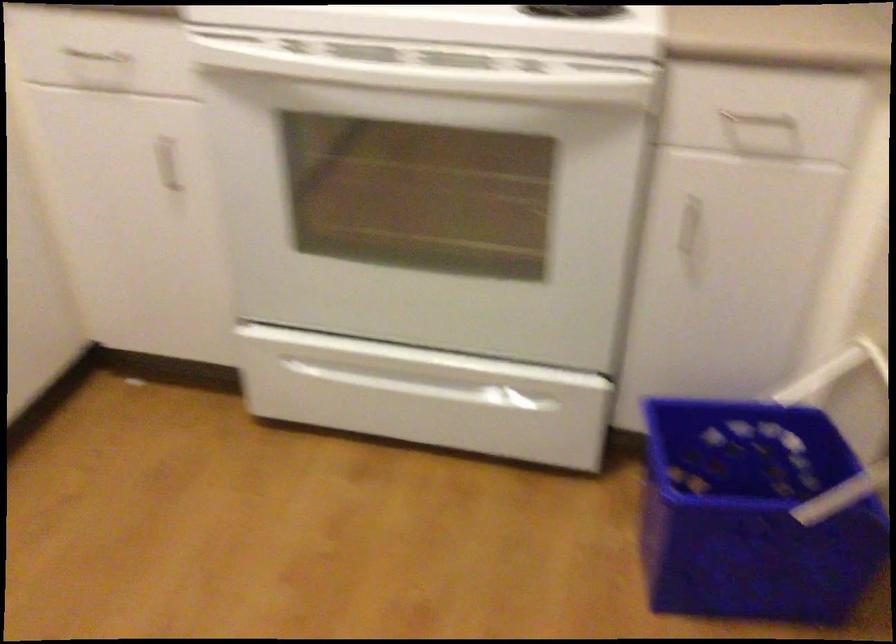
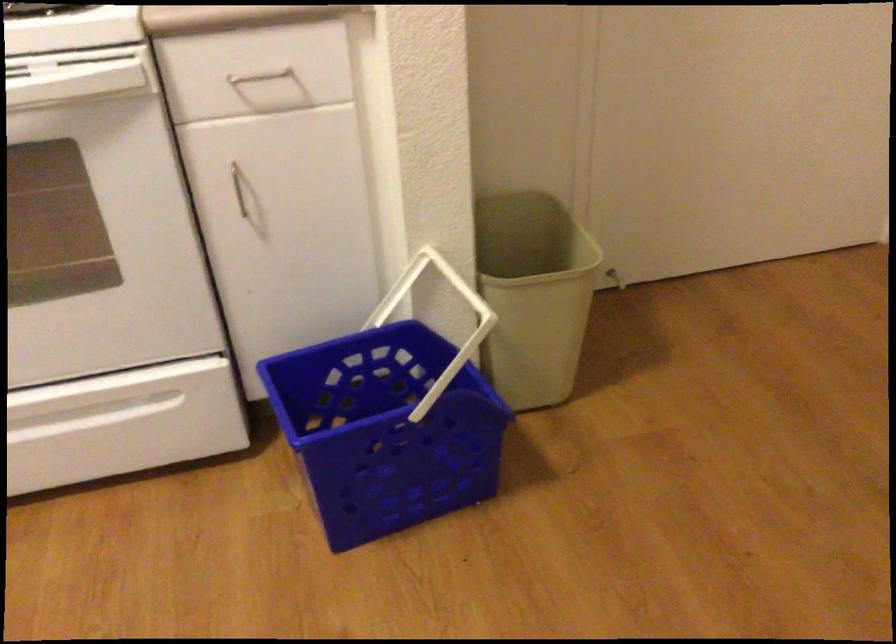
Question: How did the camera likely rotate?

Choices:
 (A) Left
 (B) Right
 (C) Up
 (D) Down

Answer: (B)